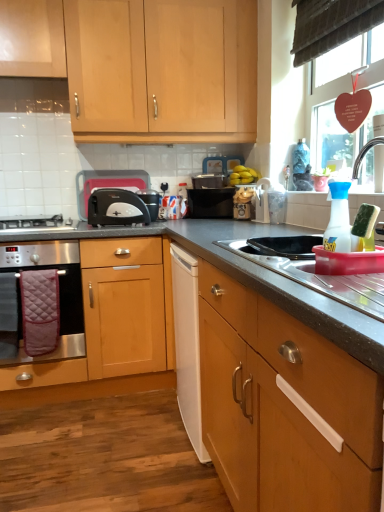
Question: From the image's perspective, relative to white plastic toaster at center-left, is stainless steel oven at lower left above or below?

Choices:
 (A) below
 (B) above

Answer: (A)

Question: Is point coord(34,256) positioned closer to the camera than point coord(147,186)?

Choices:
 (A) closer
 (B) farther

Answer: (A)

Question: Estimate the real-world distances between objects in this image. Which object is farther from the stainless steel oven at lower left?

Choices:
 (A) dark gray laminate countertop at center
 (B) white plastic toaster at center-left
 (C) stainless steel sink at lower right
 (D) brown fabric exhaust hood at upper center
 (E) yellow matte bananas at upper center

Answer: (D)

Question: Which object is positioned closest to the matte plastic jar at center, marked as the fourth appliance in a front-to-back arrangement?

Choices:
 (A) wooden cabinet at lower right, the second cabinetry positioned from the top
 (B) dark gray laminate countertop at center
 (C) brown fabric exhaust hood at upper center
 (D) light wood/finish cabinet at upper left, the second cabinetry from the front
 (E) white plastic sponge at right, marked as the first appliance in a front-to-back arrangement

Answer: (B)